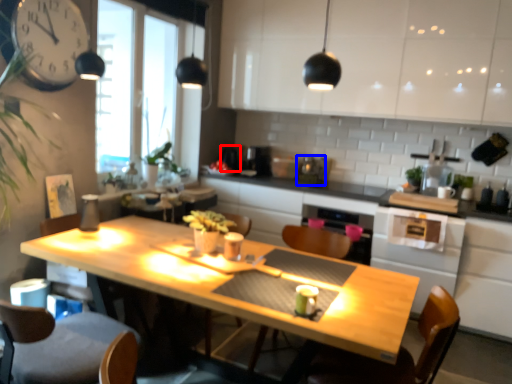
Question: Among these objects, which one is nearest to the camera, appliance (highlighted by a red box) or appliance (highlighted by a blue box)?

Choices:
 (A) appliance
 (B) appliance

Answer: (B)